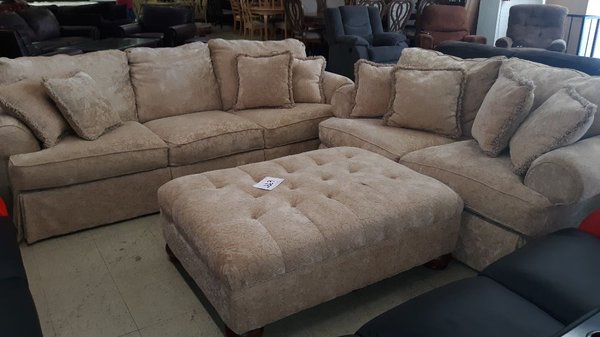
This screenshot has width=600, height=337. I want to click on couch seating cushions, so click(x=115, y=148), click(x=214, y=145), click(x=292, y=121), click(x=388, y=143), click(x=475, y=177).